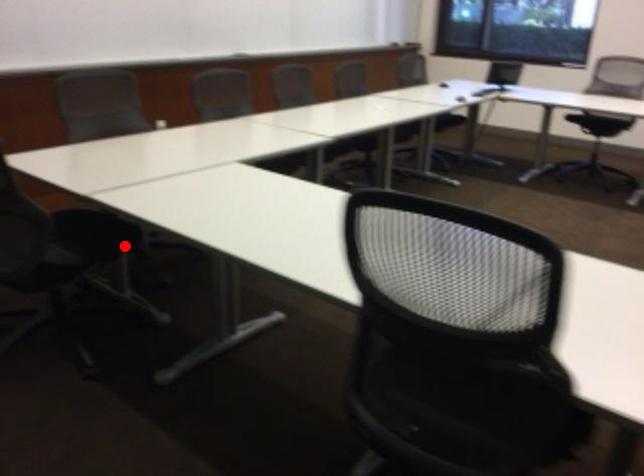
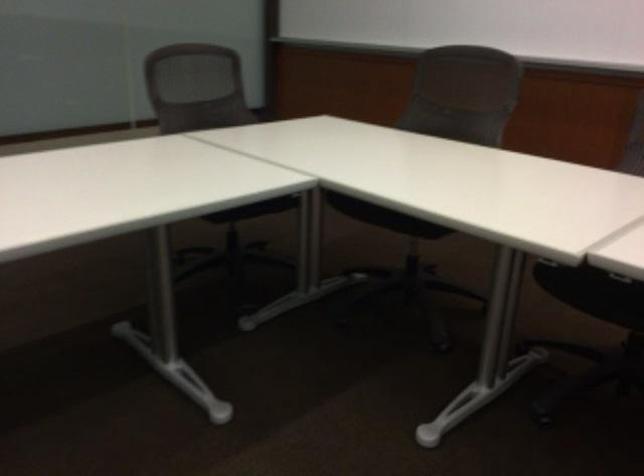
Question: I am providing you with two images of the same scene from different viewpoints. A red point is shown in image1. For the corresponding object point in image2, is it positioned nearer or farther from the camera?

Choices:
 (A) Nearer
 (B) Farther

Answer: (A)